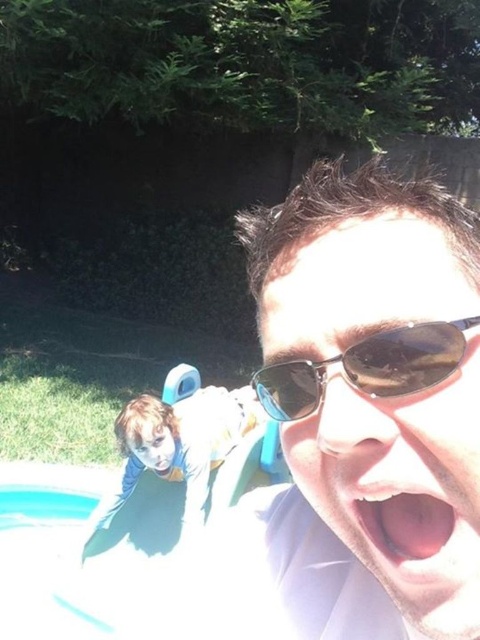
You are a photographer trying to capture a candid shot of the scene. You notice the black reflective sunglasses at upper center and the pink flesh at center. Which object is positioned to the left of the other?

The black reflective sunglasses at upper center is to the left of pink flesh at center.

You are a photographer trying to capture the black reflective sunglasses at upper center and the pink flesh at center in a photo. Which object should you focus on first if you want to ensure both are in focus?

The black reflective sunglasses at upper center is above the pink flesh at center, so you should focus on the pink flesh at center first since it is closer to the camera.

You are a photographer trying to capture a clear shot of both the sunglasses at center and the black reflective sunglasses at upper center. Which sunglasses should you focus on to ensure they appear larger in the photo?

The sunglasses at center should be focused on because it is much taller than the black reflective sunglasses at upper center, making it appear larger in the photo.